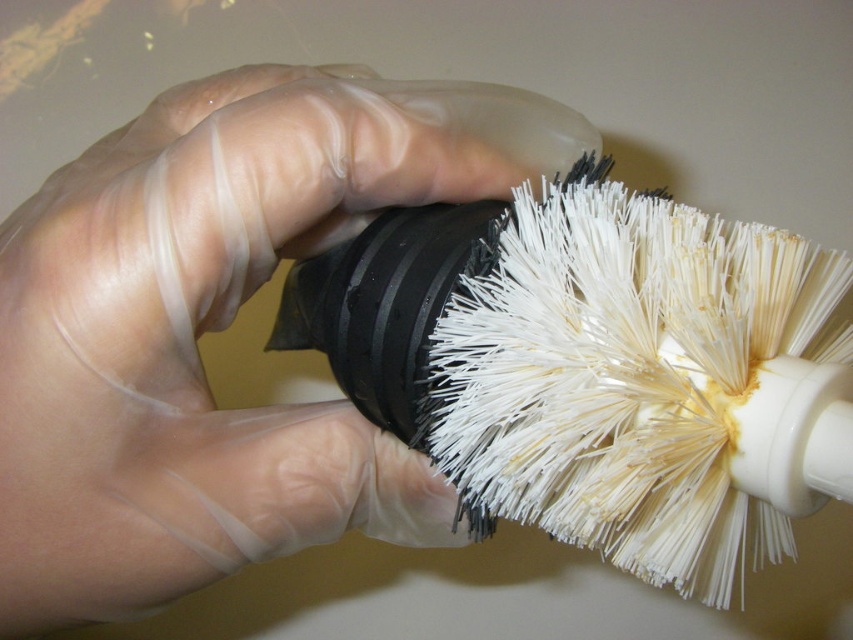
Is point (236, 444) positioned behind point (386, 413)?

No, it is not.

Who is positioned more to the left, transparent plastic glove at center or white bristle brush at center?

transparent plastic glove at center is more to the left.

This screenshot has width=853, height=640. What are the coordinates of `transparent plastic glove at center` in the screenshot? It's located at (195, 344).

Locate an element on the screen. The width and height of the screenshot is (853, 640). transparent plastic glove at center is located at coordinates (195, 344).